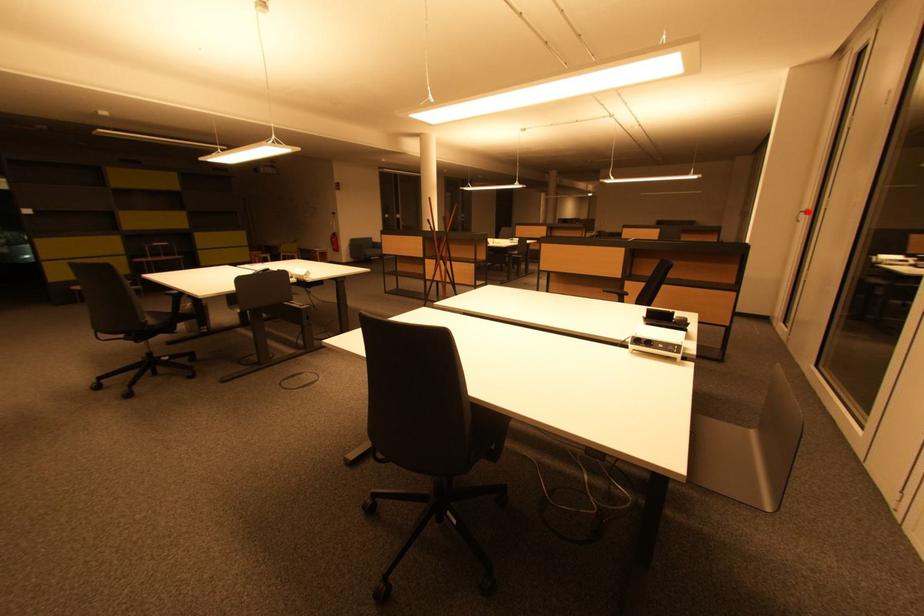
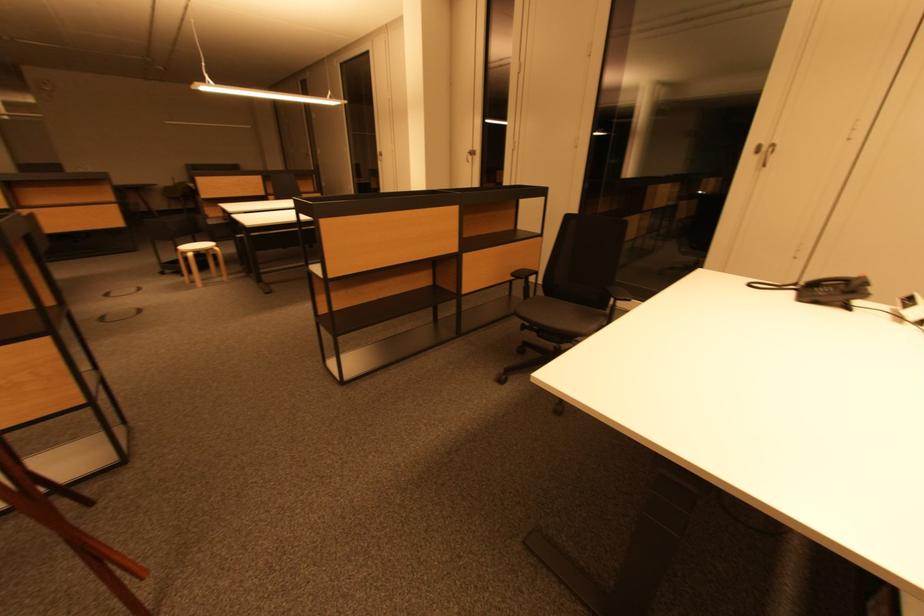
Find the pixel in the second image that matches the highlighted location in the first image.

(470, 152)